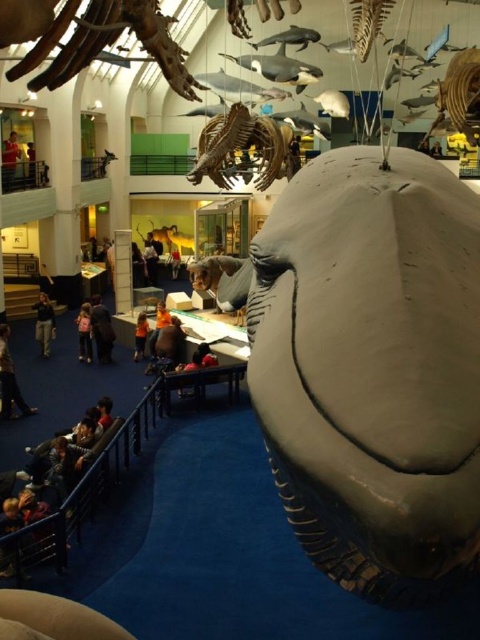
Is smooth gray dinosaur at upper center below dark gray fabric jacket at lower left?

No, smooth gray dinosaur at upper center is not below dark gray fabric jacket at lower left.

You are a GUI agent. You are given a task and a screenshot of the screen. Output one action in this format:
    pyautogui.click(x=<x>, y=<y>)
    Task: Click on the smooth gray dinosaur at upper center
    Image resolution: width=480 pixels, height=640 pixels.
    Given the screenshot: What is the action you would take?
    tap(106, 44)

Which is below, shiny metallic dinosaur skeleton at center or dark brown fur at center?

Positioned lower is dark brown fur at center.

Between shiny metallic dinosaur skeleton at center and dark brown fur at center, which one is positioned higher?

shiny metallic dinosaur skeleton at center

The height and width of the screenshot is (640, 480). I want to click on shiny metallic dinosaur skeleton at center, so click(x=240, y=148).

From the picture: Between pink fabric at lower center and dark brown leather jacket at upper center, which one appears on the right side from the viewer's perspective?

pink fabric at lower center

Can you confirm if pink fabric at lower center is positioned to the right of dark brown leather jacket at upper center?

Correct, you'll find pink fabric at lower center to the right of dark brown leather jacket at upper center.

Image resolution: width=480 pixels, height=640 pixels. What are the coordinates of `pink fabric at lower center` in the screenshot? It's located at (84, 333).